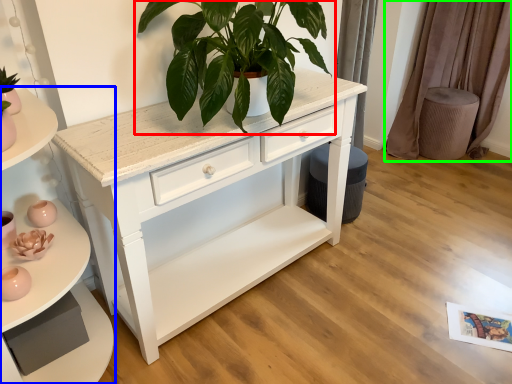
Question: Which object is positioned farthest from houseplant (highlighted by a red box)? Select from shelf (highlighted by a blue box) and curtain (highlighted by a green box).

Choices:
 (A) shelf
 (B) curtain

Answer: (B)